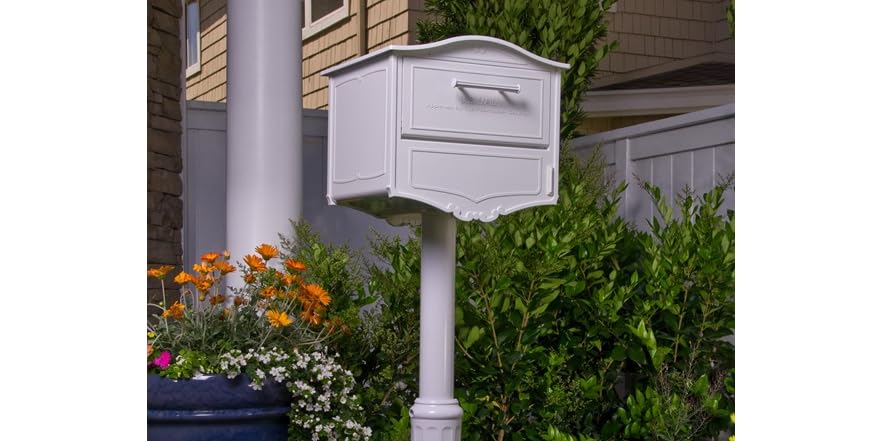
Where is `blue planter`? The width and height of the screenshot is (882, 441). blue planter is located at coordinates (247, 386).